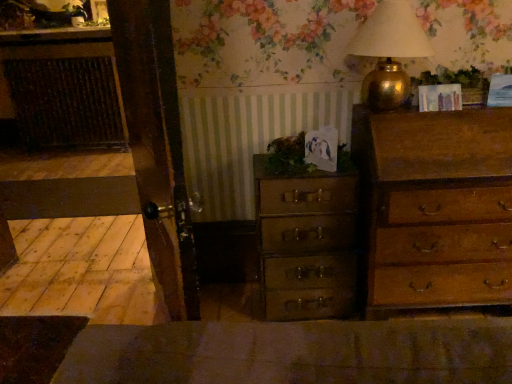
Question: Is wooden chest of drawers at right, positioned as the 1th chest of drawers in right-to-left order, behind wooden chest of drawers at center, which is counted as the second chest of drawers, starting from the right?

Choices:
 (A) yes
 (B) no

Answer: (B)

Question: Does wooden chest of drawers at right, the second chest of drawers positioned from the left, appear on the left side of wooden chest of drawers at center, which is the first chest of drawers in left-to-right order?

Choices:
 (A) no
 (B) yes

Answer: (A)

Question: From a real-world perspective, is wooden chest of drawers at right, the second chest of drawers positioned from the left, below wooden chest of drawers at center, which is counted as the second chest of drawers, starting from the right?

Choices:
 (A) no
 (B) yes

Answer: (A)

Question: From the image's perspective, is wooden chest of drawers at right, positioned as the 1th chest of drawers in right-to-left order, located beneath wooden chest of drawers at center, which is counted as the second chest of drawers, starting from the right?

Choices:
 (A) no
 (B) yes

Answer: (A)

Question: Does wooden chest of drawers at right, positioned as the 1th chest of drawers in right-to-left order, have a lesser width compared to wooden chest of drawers at center, which is the first chest of drawers in left-to-right order?

Choices:
 (A) yes
 (B) no

Answer: (B)

Question: Relative to gold metallic table lamp at upper right, is wooden chest of drawers at right, positioned as the 1th chest of drawers in right-to-left order, in front or behind?

Choices:
 (A) front
 (B) behind

Answer: (B)

Question: Considering the positions of wooden chest of drawers at right, positioned as the 1th chest of drawers in right-to-left order, and gold metallic table lamp at upper right in the image, is wooden chest of drawers at right, positioned as the 1th chest of drawers in right-to-left order, taller or shorter than gold metallic table lamp at upper right?

Choices:
 (A) short
 (B) tall

Answer: (B)

Question: From a real-world perspective, is wooden chest of drawers at right, positioned as the 1th chest of drawers in right-to-left order, positioned above or below gold metallic table lamp at upper right?

Choices:
 (A) above
 (B) below

Answer: (B)

Question: Considering the relative positions of wooden chest of drawers at right, the second chest of drawers positioned from the left, and gold metallic table lamp at upper right in the image provided, is wooden chest of drawers at right, the second chest of drawers positioned from the left, to the left or to the right of gold metallic table lamp at upper right?

Choices:
 (A) left
 (B) right

Answer: (B)

Question: Does point (458, 72) appear closer or farther from the camera than point (384, 8)?

Choices:
 (A) closer
 (B) farther

Answer: (B)

Question: In terms of height, does green leafy plant at upper right, acting as the second plant starting from the bottom, look taller or shorter compared to gold metallic table lamp at upper right?

Choices:
 (A) tall
 (B) short

Answer: (B)

Question: From the image's perspective, is green leafy plant at upper right, acting as the 2th plant starting from the left, above or below gold metallic table lamp at upper right?

Choices:
 (A) below
 (B) above

Answer: (A)

Question: Is green leafy plant at upper right, acting as the second plant starting from the bottom, in front of or behind gold metallic table lamp at upper right in the image?

Choices:
 (A) behind
 (B) front

Answer: (A)

Question: Considering the positions of point (301, 269) and point (276, 147), is point (301, 269) closer or farther from the camera than point (276, 147)?

Choices:
 (A) farther
 (B) closer

Answer: (A)

Question: From a real-world perspective, is wooden chest of drawers at center, which is the first chest of drawers in left-to-right order, physically located above or below green leafy plant at center, the first plant positioned from the left?

Choices:
 (A) above
 (B) below

Answer: (B)